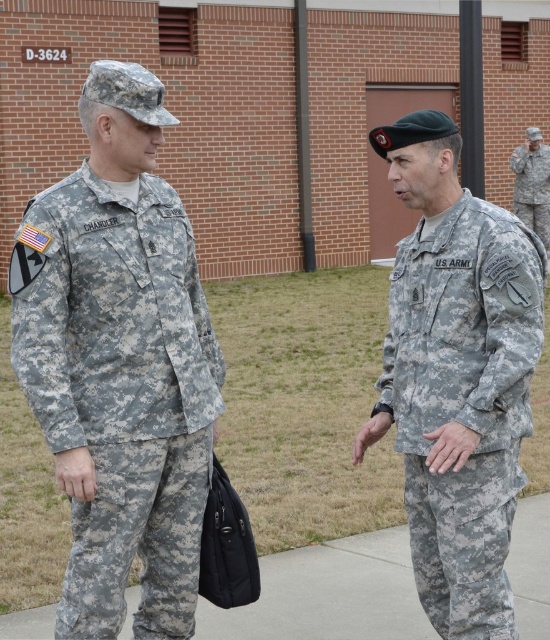
Question: Is gray concrete pavement at center thinner than camouflage fabric uniform at right?

Choices:
 (A) no
 (B) yes

Answer: (A)

Question: Which point is closer to the camera?

Choices:
 (A) (547, 188)
 (B) (541, 628)
 (C) (442, 493)

Answer: (C)

Question: Which of the following is the farthest from the observer?

Choices:
 (A) camouflage fabric uniform at left
 (B) gray concrete pavement at center

Answer: (B)

Question: Does camouflage fabric uniform at center have a greater width compared to gray concrete pavement at center?

Choices:
 (A) no
 (B) yes

Answer: (A)

Question: Which of these objects is positioned closest to the camouflage fabric uniform at right?

Choices:
 (A) camouflage fabric uniform at left
 (B) gray concrete pavement at center

Answer: (B)

Question: Can you confirm if camouflage fabric uniform at left is bigger than gray concrete pavement at center?

Choices:
 (A) yes
 (B) no

Answer: (A)